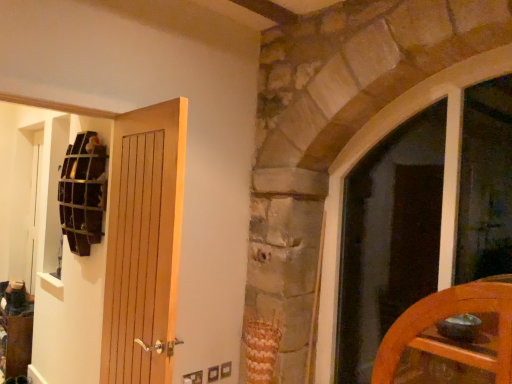
The width and height of the screenshot is (512, 384). What are the coordinates of `wooden grid at upper left` in the screenshot? It's located at (83, 192).

This screenshot has width=512, height=384. What do you see at coordinates (143, 243) in the screenshot?
I see `wooden at left, the first door viewed from the right` at bounding box center [143, 243].

Describe the element at coordinates (93, 239) in the screenshot. This screenshot has height=384, width=512. I see `wooden door at left, placed as the 2th door when sorted from right to left` at that location.

Measure the distance between point (172, 226) and camera.

Point (172, 226) is 1.69 meters from camera.

Where is `wooden grid at upper left`? wooden grid at upper left is located at coordinates (83, 192).

From the picture: Which object is positioned more to the right, wooden grid at upper left or wooden door at left, placed as the 2th door when sorted from right to left?

wooden door at left, placed as the 2th door when sorted from right to left, is more to the right.

Is wooden grid at upper left further to the viewer compared to wooden door at left, positioned as the first door in left-to-right order?

Yes, wooden grid at upper left is behind wooden door at left, positioned as the first door in left-to-right order.

Can you tell me how much wooden grid at upper left and wooden door at left, placed as the 2th door when sorted from right to left, differ in facing direction?

The facing directions of wooden grid at upper left and wooden door at left, placed as the 2th door when sorted from right to left, are 91.8 degrees apart.

Which is farther from the camera, (88, 175) or (115, 123)?

The point (88, 175) is more distant.

From their relative heights in the image, would you say wooden grid at upper left is taller or shorter than wooden at left, the first door viewed from the right?

Clearly, wooden grid at upper left is shorter compared to wooden at left, the first door viewed from the right.

Who is bigger, wooden grid at upper left or wooden at left, the first door viewed from the right?

wooden at left, the first door viewed from the right.

At what (x,y) coordinates should I click in order to perform the action: click on shelf located behind the wooden at left, which is the second door from left to right. Please return your answer as a coordinate pair (x, y). The height and width of the screenshot is (384, 512). Looking at the image, I should click on (83, 192).

Does wooden at left, which is the second door from left to right, appear on the left side of wooden grid at upper left?

No, wooden at left, which is the second door from left to right, is not to the left of wooden grid at upper left.

Is wooden at left, which is the second door from left to right, closer to camera compared to wooden grid at upper left?

Yes, wooden at left, which is the second door from left to right, is closer to the camera.

From the image's perspective, is wooden at left, the first door viewed from the right, located above or below wooden grid at upper left?

Based on their image positions, wooden at left, the first door viewed from the right, is located beneath wooden grid at upper left.

From a real-world perspective, is wooden at left, the first door viewed from the right, on top of wooden grid at upper left?

No, from a real-world perspective, wooden at left, the first door viewed from the right, is not over wooden grid at upper left

Is matte glass window at right inside the boundaries of wooden grid at upper left, or outside?

matte glass window at right is not inside wooden grid at upper left, it's outside.

Could you tell me if matte glass window at right is turned towards wooden grid at upper left?

No, matte glass window at right is not turned towards wooden grid at upper left.

Can you confirm if matte glass window at right is positioned to the right of wooden grid at upper left?

Indeed, matte glass window at right is positioned on the right side of wooden grid at upper left.

Is there a large distance between matte glass window at right and wooden grid at upper left?

→ Yes, matte glass window at right and wooden grid at upper left are quite far apart.

Who is bigger, matte glass window at right or wooden at left, which is the second door from left to right?

matte glass window at right.

Locate an element on the screen. This screenshot has width=512, height=384. window behind the wooden at left, the first door viewed from the right is located at coordinates (361, 157).

From a real-world perspective, is matte glass window at right physically located above or below wooden at left, which is the second door from left to right?

matte glass window at right is above wooden at left, which is the second door from left to right.

Which point is more distant from viewer, (77,233) or (353,141)?

The point (353,141) is behind.

Could you tell me if wooden grid at upper left is turned towards matte glass window at right?

No.

What's the angular difference between wooden grid at upper left and matte glass window at right's facing directions?

The angular difference between wooden grid at upper left and matte glass window at right is 1.83 degrees.

Can you confirm if wooden grid at upper left is taller than matte glass window at right?

No, wooden grid at upper left is not taller than matte glass window at right.

Is wooden door at left, placed as the 2th door when sorted from right to left, placed right next to wooden at left, which is the second door from left to right?

No.

Consider the image. Is wooden door at left, placed as the 2th door when sorted from right to left, bigger or smaller than wooden at left, the first door viewed from the right?

Considering their sizes, wooden door at left, placed as the 2th door when sorted from right to left, takes up less space than wooden at left, the first door viewed from the right.

Considering the sizes of objects wooden door at left, positioned as the first door in left-to-right order, and wooden at left, which is the second door from left to right, in the image provided, who is thinner, wooden door at left, positioned as the first door in left-to-right order, or wooden at left, which is the second door from left to right,?

wooden door at left, positioned as the first door in left-to-right order, is thinner.

From the image's perspective, between wooden door at left, positioned as the first door in left-to-right order, and wooden at left, the first door viewed from the right, who is located below?

wooden at left, the first door viewed from the right, from the image's perspective.

From the wooden grid at upper left, count 1st door to the right and point to it. Please provide its 2D coordinates.

[(93, 239)]

You are a GUI agent. You are given a task and a screenshot of the screen. Output one action in this format:
    pyautogui.click(x=<x>, y=<y>)
    Task: Click on the 2nd door in front of the wooden grid at upper left, counting from the anchor's position
    The image size is (512, 384).
    Given the screenshot: What is the action you would take?
    pyautogui.click(x=143, y=243)

Looking at the image, which one is located further to matte glass window at right, wooden at left, which is the second door from left to right, or wooden grid at upper left?

wooden grid at upper left lies further to matte glass window at right than the other object.

Looking at the image, which one is located further to matte glass window at right, wooden door at left, placed as the 2th door when sorted from right to left, or wooden grid at upper left?

wooden door at left, placed as the 2th door when sorted from right to left, is further to matte glass window at right.

Looking at the image, which one is located closer to wooden door at left, positioned as the first door in left-to-right order, matte glass window at right or wooden grid at upper left?

Based on the image, wooden grid at upper left appears to be nearer to wooden door at left, positioned as the first door in left-to-right order.

Based on their spatial positions, is wooden grid at upper left or matte glass window at right further from wooden door at left, placed as the 2th door when sorted from right to left?

matte glass window at right lies further to wooden door at left, placed as the 2th door when sorted from right to left, than the other object.

Based on their spatial positions, is wooden grid at upper left or matte glass window at right closer to wooden at left, which is the second door from left to right?

wooden grid at upper left lies closer to wooden at left, which is the second door from left to right, than the other object.

Based on their spatial positions, is wooden door at left, positioned as the first door in left-to-right order, or wooden at left, the first door viewed from the right, closer to wooden grid at upper left?

wooden door at left, positioned as the first door in left-to-right order.

When comparing their distances from wooden grid at upper left, does wooden at left, the first door viewed from the right, or wooden door at left, placed as the 2th door when sorted from right to left, seem further?

wooden at left, the first door viewed from the right, lies further to wooden grid at upper left than the other object.

Estimate the real-world distances between objects in this image. Which object is closer to wooden at left, which is the second door from left to right, matte glass window at right or wooden door at left, placed as the 2th door when sorted from right to left?

wooden door at left, placed as the 2th door when sorted from right to left, is closer to wooden at left, which is the second door from left to right.

This screenshot has width=512, height=384. I want to click on door between wooden at left, which is the second door from left to right, and wooden grid at upper left, along the z-axis, so click(x=93, y=239).

Locate an element on the screen. This screenshot has height=384, width=512. door between wooden door at left, placed as the 2th door when sorted from right to left, and matte glass window at right, in the horizontal direction is located at coordinates (143, 243).